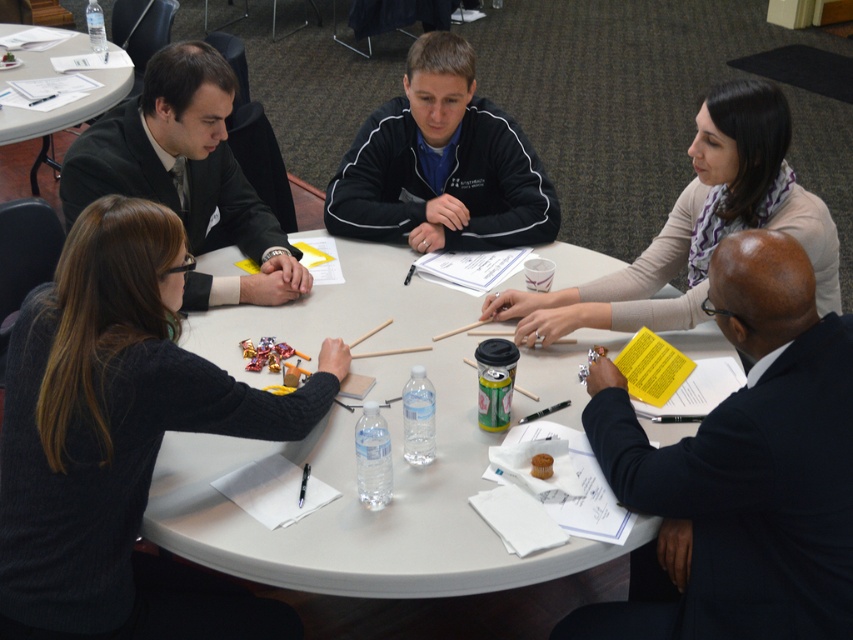
Who is shorter, white plastic table at center or white plastic table at upper left?

white plastic table at center

Does white plastic table at center have a lesser height compared to white plastic table at upper left?

Yes.

Between point (183, 342) and point (21, 74), which one is positioned in front?

Point (183, 342) is in front.

Find the location of `white plastic table at center`. white plastic table at center is located at coordinates (361, 506).

Does white plastic table at center have a greater width compared to light beige scarf at upper right?

Correct, the width of white plastic table at center exceeds that of light beige scarf at upper right.

Which of these two, white plastic table at center or light beige scarf at upper right, stands taller?

white plastic table at center

Where is `white plastic table at center`? white plastic table at center is located at coordinates (361, 506).

Between point (144, 147) and point (44, 154), which one is positioned behind?

The point (44, 154) is behind.

Does matte black suit at upper left have a smaller size compared to white plastic table at upper left?

Yes.

Which is in front, point (260, 204) or point (7, 122)?

Point (260, 204) is more forward.

You are a GUI agent. You are given a task and a screenshot of the screen. Output one action in this format:
    pyautogui.click(x=<x>, y=<y>)
    Task: Click on the matte black suit at upper left
    Image resolution: width=853 pixels, height=640 pixels.
    Given the screenshot: What is the action you would take?
    [184, 172]